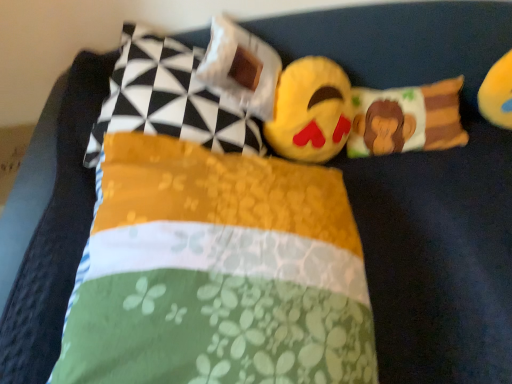
This screenshot has height=384, width=512. In order to click on empty space that is ontop of fluffy fabric monkey pillow at center, arranged as the fourth pillow when viewed from the left (from a real-world perspective) in this screenshot , I will do `click(407, 97)`.